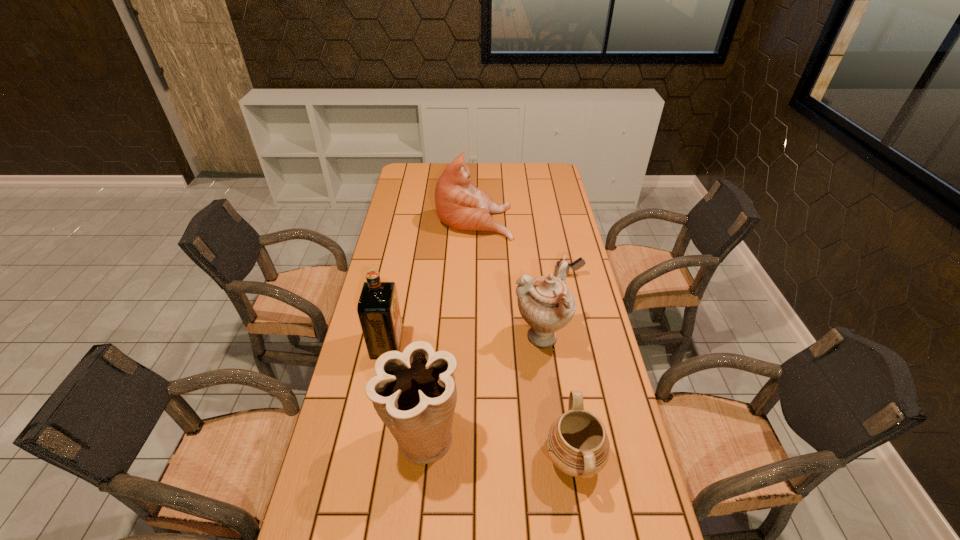
Where is `the farthest object`? The width and height of the screenshot is (960, 540). the farthest object is located at coordinates (459, 203).

Locate an element on the screen. liquor is located at coordinates (378, 309).

At what (x,y) coordinates should I click in order to perform the action: click on the leftmost urn. Please return your answer as a coordinate pair (x, y). Looking at the image, I should click on (414, 393).

Find the location of a particular element. The height and width of the screenshot is (540, 960). the farthest urn is located at coordinates (546, 304).

You are a GUI agent. You are given a task and a screenshot of the screen. Output one action in this format:
    pyautogui.click(x=<x>, y=<y>)
    Task: Click on the shortest urn
    Image resolution: width=960 pixels, height=540 pixels.
    Given the screenshot: What is the action you would take?
    pyautogui.click(x=576, y=442)

Locate an element on the screen. the fifth nearest object is located at coordinates (580, 262).

I want to click on igniter, so click(x=580, y=262).

Locate an element on the screen. Image resolution: width=960 pixels, height=540 pixels. vacant space located on the face of the farthest object is located at coordinates (572, 219).

Image resolution: width=960 pixels, height=540 pixels. In order to click on vacant space located 0.240m on the front label of the liquor in this screenshot , I will do `click(477, 345)`.

Identify the location of free spot located on the back of the leftmost urn. (433, 337).